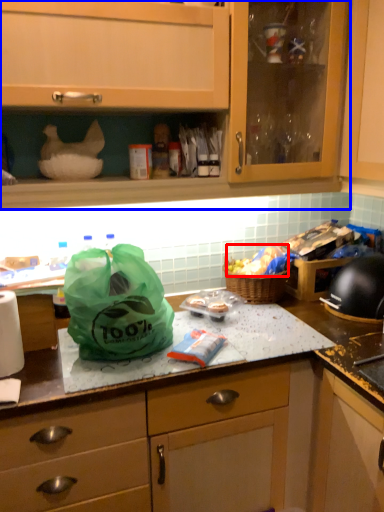
Question: Which object is closer to the camera taking this photo, food (highlighted by a red box) or cabinetry (highlighted by a blue box)?

Choices:
 (A) food
 (B) cabinetry

Answer: (B)